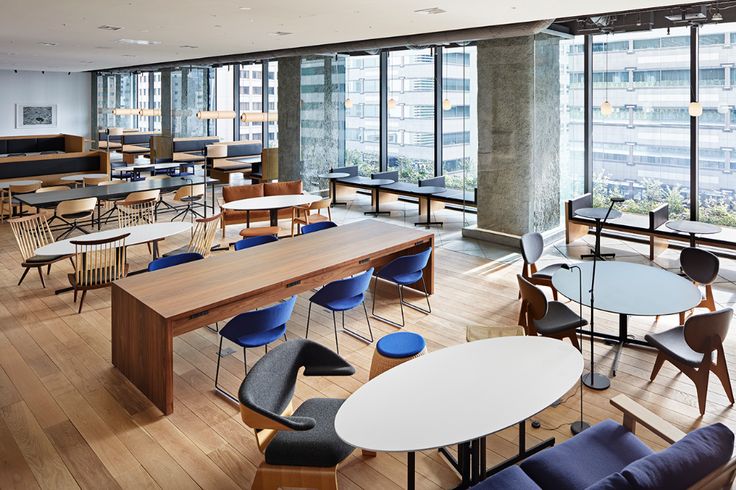
The width and height of the screenshot is (736, 490). I want to click on cobalt blue seats, so click(263, 317), click(350, 291), click(402, 268), click(308, 228), click(252, 242), click(166, 257), click(405, 345).